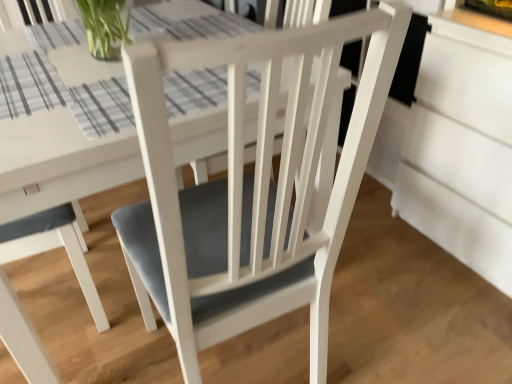
Where is `free spot above white wood chair at center (from a real-world perspective)`? This screenshot has height=384, width=512. free spot above white wood chair at center (from a real-world perspective) is located at coordinates (80, 74).